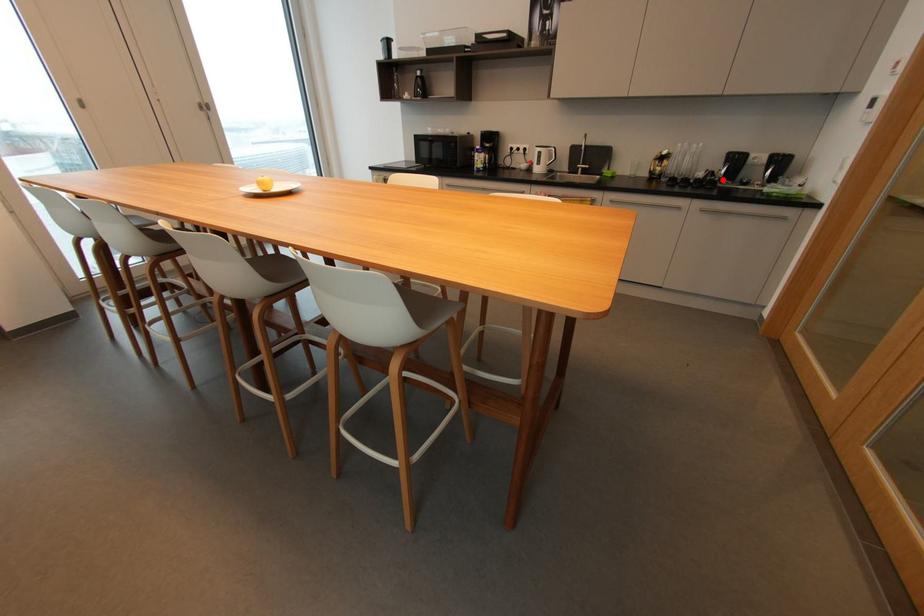
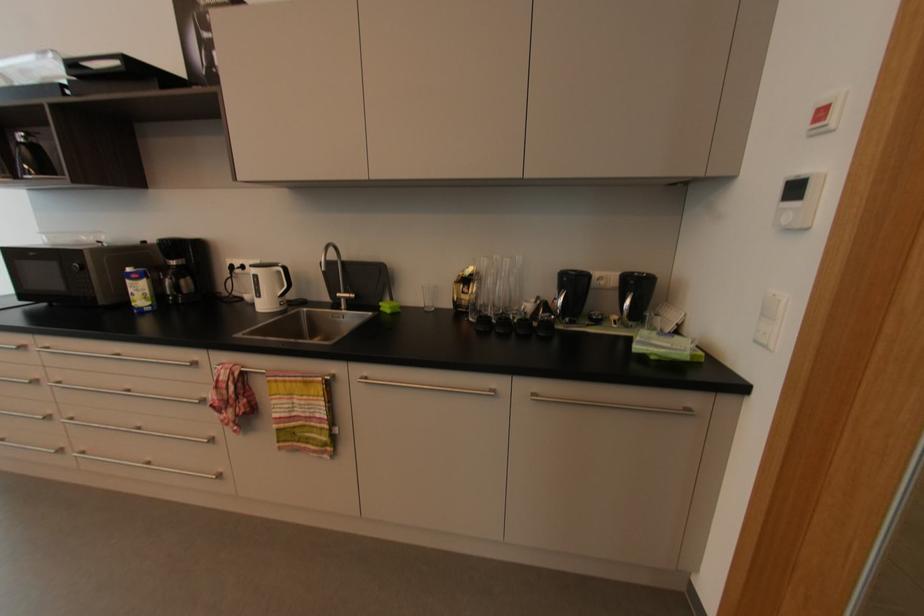
Where in the second image is the point corresponding to the highlighted location from the first image?

(561, 317)